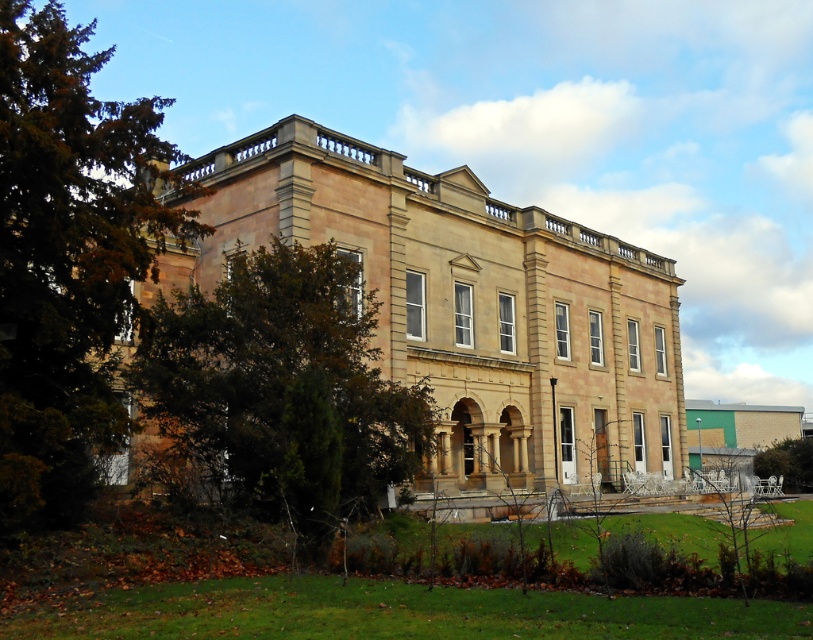
Does beige stone palace at center appear on the left side of green leafy tree at left?

No, beige stone palace at center is not to the left of green leafy tree at left.

Where is `beige stone palace at center`? Image resolution: width=813 pixels, height=640 pixels. beige stone palace at center is located at coordinates (467, 307).

What do you see at coordinates (467, 307) in the screenshot? The image size is (813, 640). I see `beige stone palace at center` at bounding box center [467, 307].

The height and width of the screenshot is (640, 813). Identify the location of beige stone palace at center. (467, 307).

Is point (716, 444) farther from viewer compared to point (803, 467)?

Yes, it is.

Who is higher up, beige stone mansion at center or green leafy tree at lower right?

Positioned higher is green leafy tree at lower right.

Describe the element at coordinates (735, 432) in the screenshot. The height and width of the screenshot is (640, 813). I see `beige stone mansion at center` at that location.

Identify the location of beige stone mansion at center. The height and width of the screenshot is (640, 813). (735, 432).

Between green leafy tree at left and green leafy tree at lower right, which one is positioned higher?

green leafy tree at left is above.

Between green leafy tree at left and green leafy tree at lower right, which one is positioned lower?

green leafy tree at lower right is lower down.

I want to click on green leafy tree at left, so click(x=277, y=392).